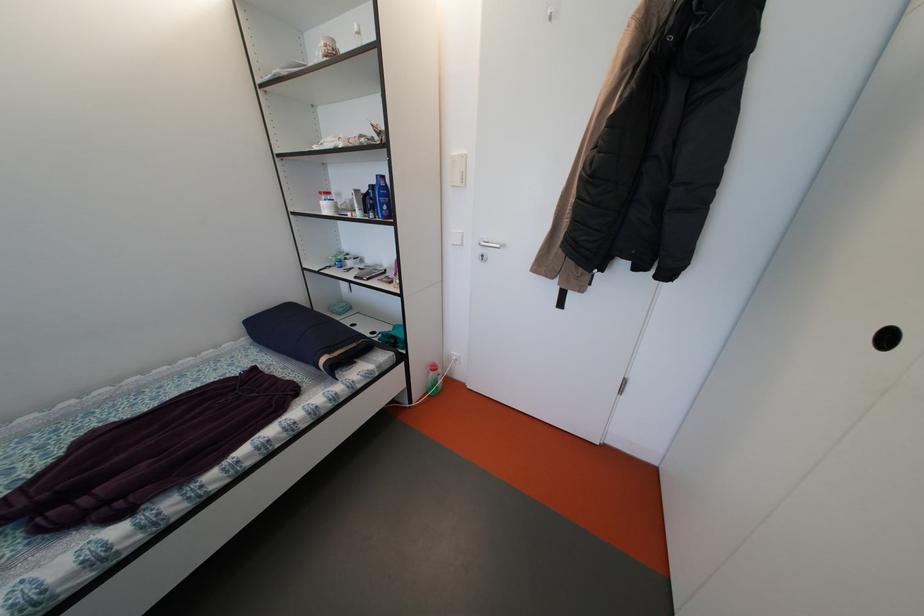
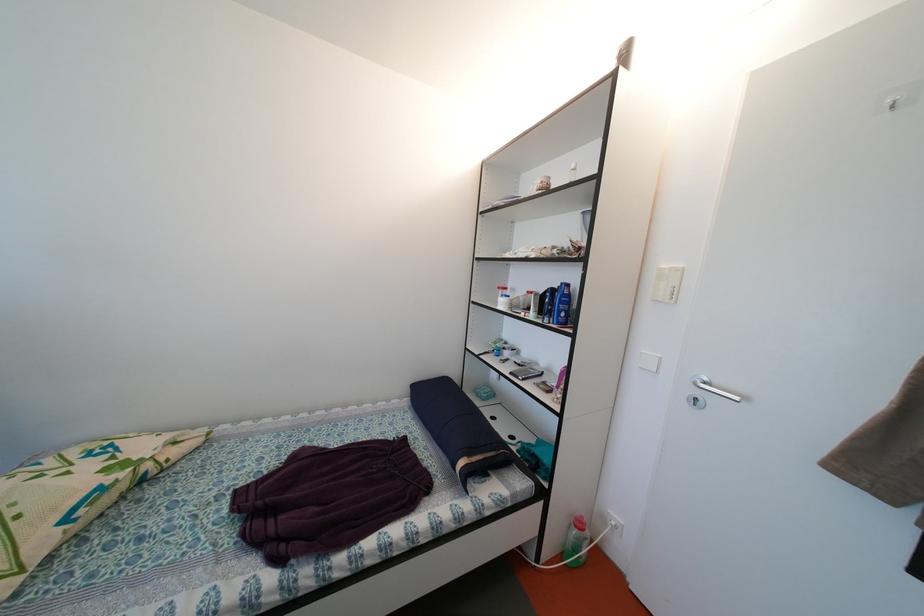
In the second image, find the point that corresponds to point 327,198 in the first image.

(505, 293)